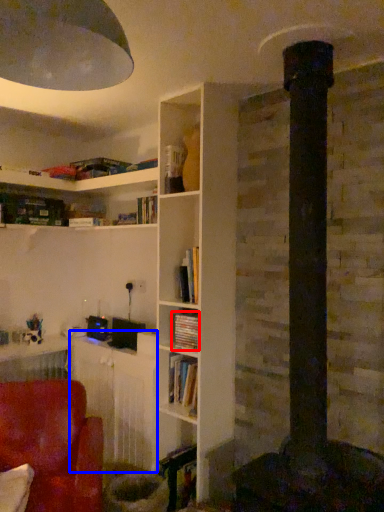
Question: Which object appears farthest to the camera in this image, book (highlighted by a red box) or table (highlighted by a blue box)?

Choices:
 (A) book
 (B) table

Answer: (B)